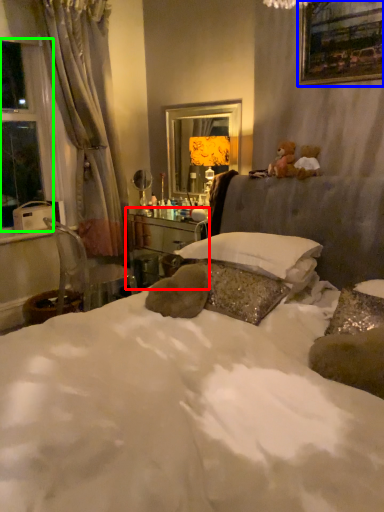
Question: Which object is positioned closest to vanity (highlighted by a red box)? Select from picture frame (highlighted by a blue box) and window (highlighted by a green box).

Choices:
 (A) picture frame
 (B) window

Answer: (B)